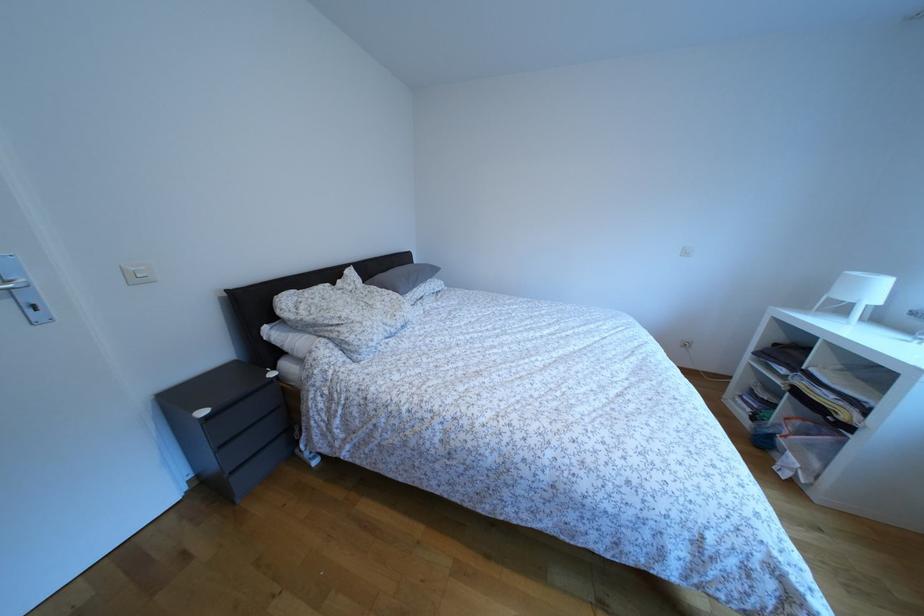
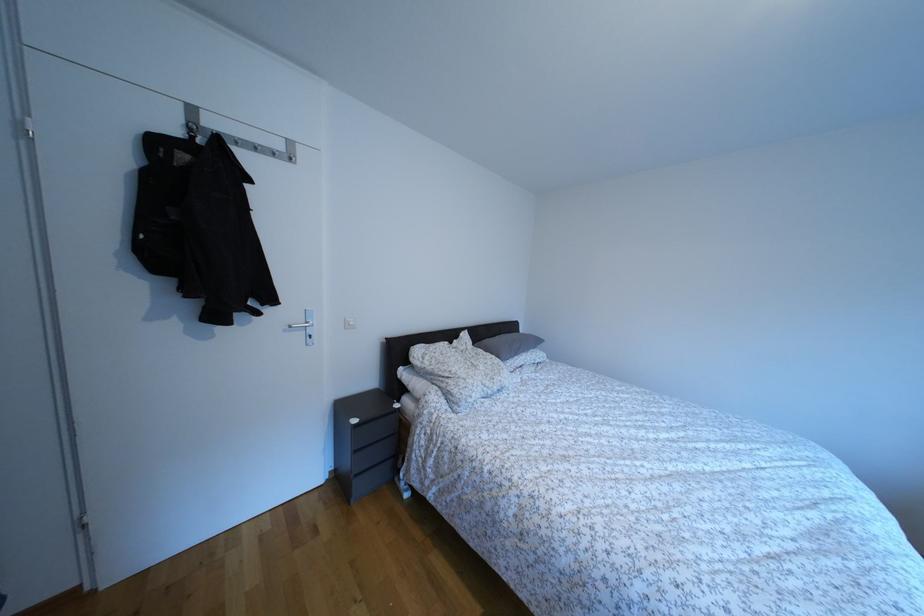
The point at (183, 406) is marked in the first image. Where is the corresponding point in the second image?

(349, 413)